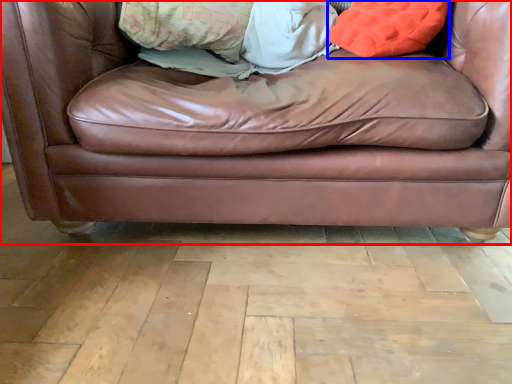
Question: Which point is further to the camera, studio couch (highlighted by a red box) or throw pillow (highlighted by a blue box)?

Choices:
 (A) studio couch
 (B) throw pillow

Answer: (B)